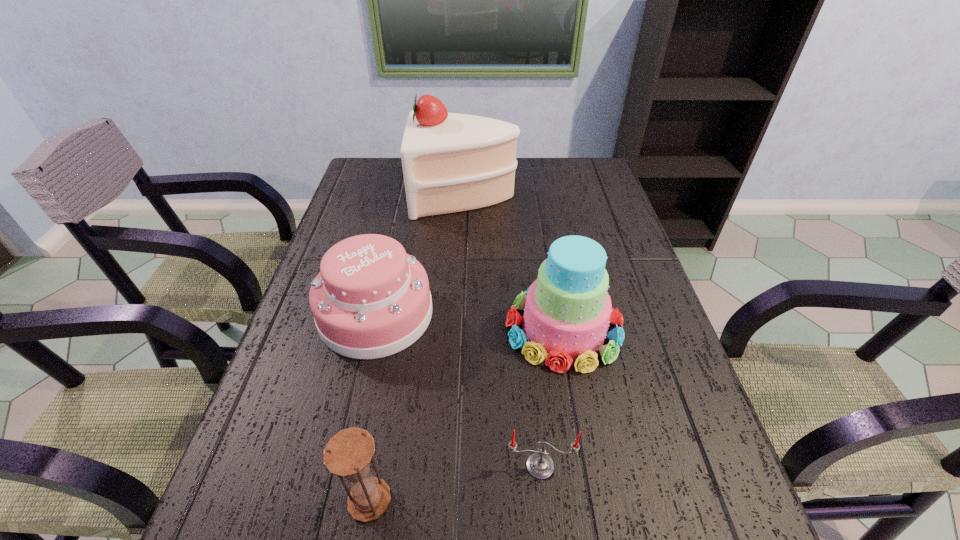
Point out which cake is positioned as the third nearest to the hourglass. Please provide its 2D coordinates. Your answer should be formatted as a tuple, i.e. [(x, y)], where the tuple contains the x and y coordinates of a point satisfying the conditions above.

[(452, 162)]

Where is `free space that satisfies the following two spatial constraints: 1. on the back side of the hourglass; 2. on the right side of the farthest object`? free space that satisfies the following two spatial constraints: 1. on the back side of the hourglass; 2. on the right side of the farthest object is located at coordinates (422, 195).

Where is `free location that satisfies the following two spatial constraints: 1. on the back side of the shortest cake; 2. on the left side of the farthest object`? Image resolution: width=960 pixels, height=540 pixels. free location that satisfies the following two spatial constraints: 1. on the back side of the shortest cake; 2. on the left side of the farthest object is located at coordinates (403, 195).

The width and height of the screenshot is (960, 540). Identify the location of free spot that satisfies the following two spatial constraints: 1. on the back side of the farthest cake; 2. on the right side of the hourglass. (422, 195).